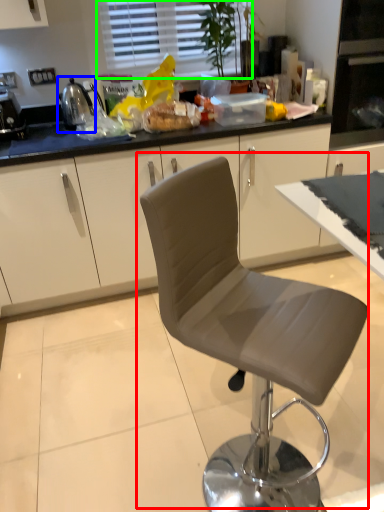
Question: Estimate the real-world distances between objects in this image. Which object is farther from chair (highlighted by a red box), appliance (highlighted by a blue box) or window (highlighted by a green box)?

Choices:
 (A) appliance
 (B) window

Answer: (B)